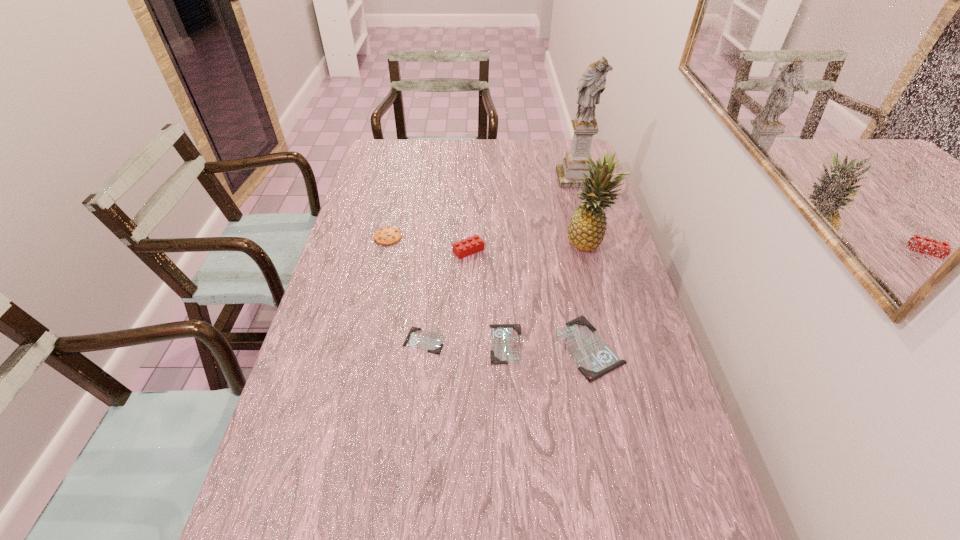
Image resolution: width=960 pixels, height=540 pixels. I want to click on free point that keeps the identity cards evenly spaced on the left, so (x=344, y=337).